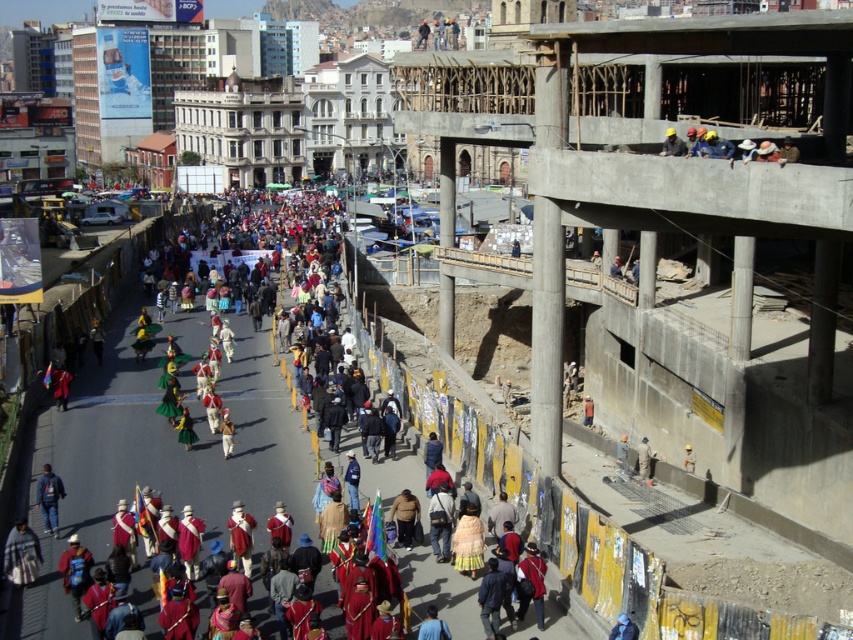
Is the position of brown leather jacket at center more distant than that of light brown fabric jacket at lower right?

No, brown leather jacket at center is in front of light brown fabric jacket at lower right.

Between point (405, 522) and point (645, 442), which one is positioned in front?

Point (405, 522) is in front.

Identify the location of brown leather jacket at center. This screenshot has width=853, height=640. (404, 516).

Which is more to the left, light brown fabric jacket at lower right or white fabric at center?

From the viewer's perspective, light brown fabric jacket at lower right appears more on the left side.

Is point (642, 452) positioned after point (685, 456)?

No, it is not.

Is point (642, 448) positioned in front of point (694, 456)?

That is True.

Identify the location of light brown fabric jacket at lower right. The width and height of the screenshot is (853, 640). (643, 460).

Can you confirm if red fabric costumes at center is positioned to the right of dark blue backpack at lower left?

In fact, red fabric costumes at center is to the left of dark blue backpack at lower left.

Who is shorter, red fabric costumes at center or dark blue backpack at lower left?

With less height is dark blue backpack at lower left.

Measure the distance between point (113, 419) and camera.

The distance of point (113, 419) from camera is 50.21 meters.

Identify the location of red fabric costumes at center. The image size is (853, 640). (155, 440).